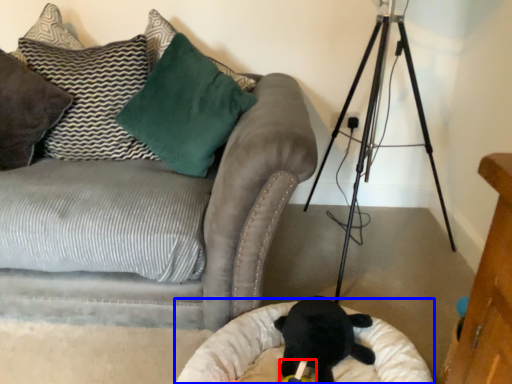
Question: Which object is closer to the camera taking this photo, toy (highlighted by a red box) or cat bed (highlighted by a blue box)?

Choices:
 (A) toy
 (B) cat bed

Answer: (B)